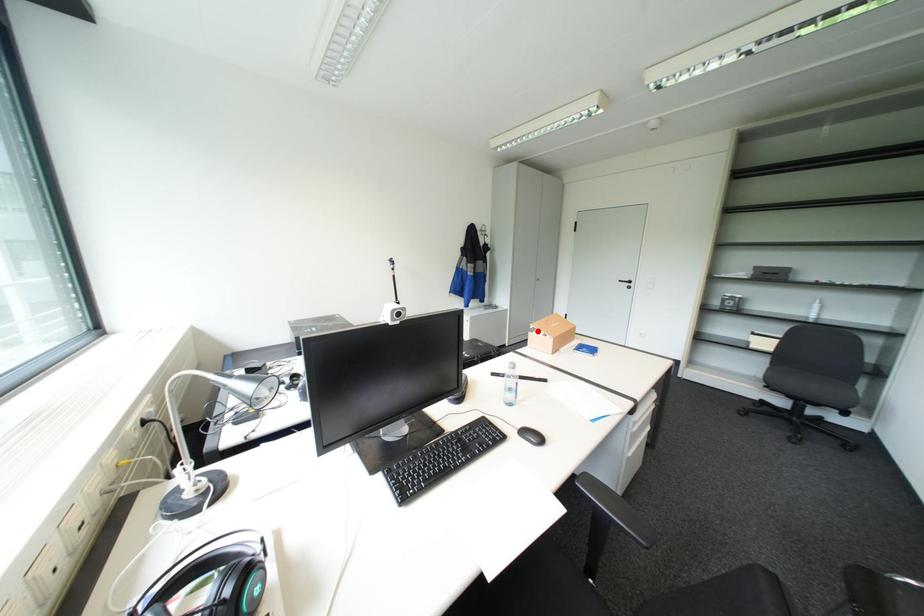
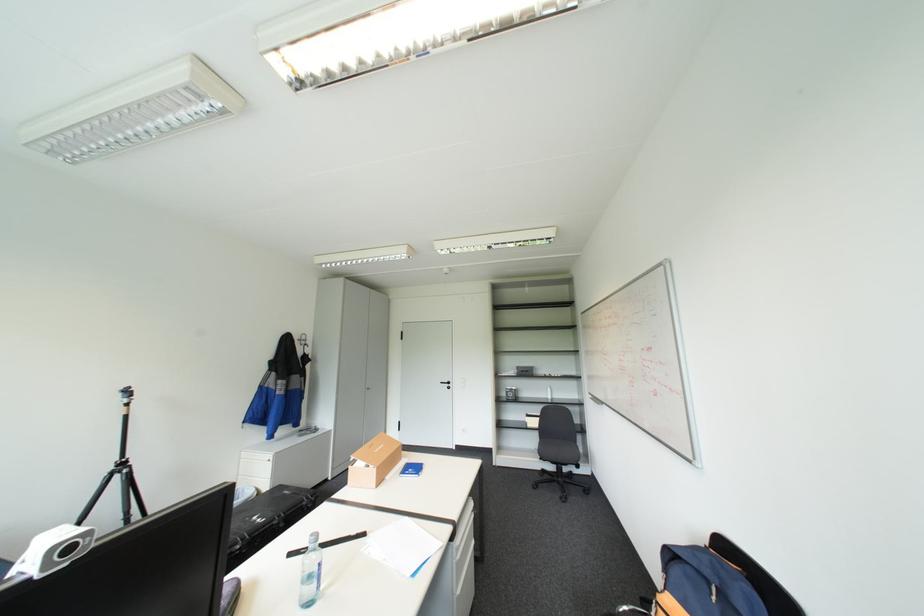
Where in the second image is the point corresponding to the highlighted location from the first image?

(358, 464)